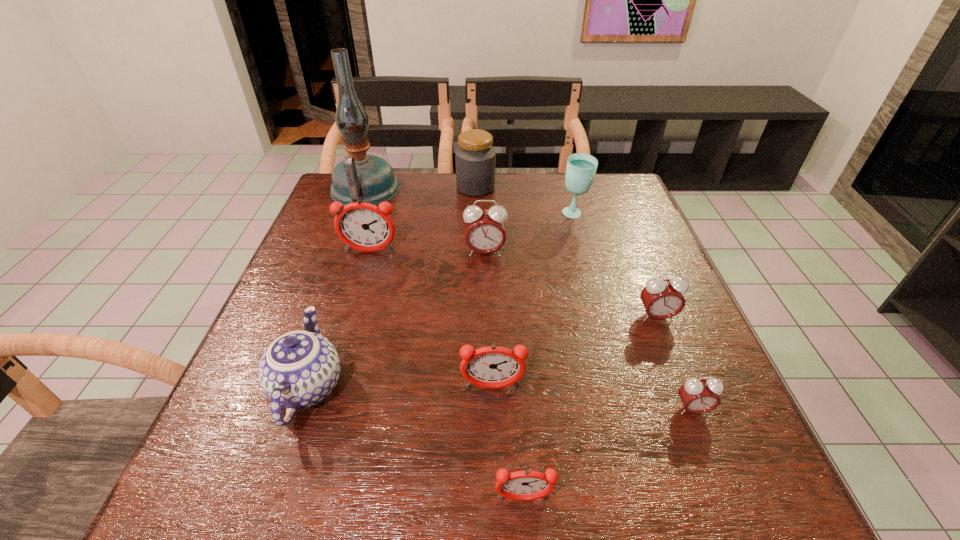
The width and height of the screenshot is (960, 540). I want to click on object located at the near edge, so click(x=526, y=485).

Where is `oil lamp that is positioned at the left edge`? This screenshot has width=960, height=540. oil lamp that is positioned at the left edge is located at coordinates (369, 178).

Where is `alarm clock present at the left edge`? The width and height of the screenshot is (960, 540). alarm clock present at the left edge is located at coordinates (363, 226).

The height and width of the screenshot is (540, 960). Identify the location of chinaware that is at the left edge. (299, 369).

You are a GUI agent. You are given a task and a screenshot of the screen. Output one action in this format:
    pyautogui.click(x=<x>, y=<y>)
    Task: Click on the glass at the right edge
    The image size is (960, 540).
    Given the screenshot: What is the action you would take?
    pyautogui.click(x=581, y=168)

Identify the location of object that is positioned at the far left corner. (369, 178).

What are the coordinates of `object situated at the far right corner` in the screenshot? It's located at (581, 168).

In the image, there is a desktop. Identify the location of vacant space at the far edge. The height and width of the screenshot is (540, 960). (460, 207).

The image size is (960, 540). Find the location of `free region at the near edge of the desktop`. free region at the near edge of the desktop is located at coordinates (451, 507).

This screenshot has width=960, height=540. In the image, there is a desktop. What are the coordinates of `free region at the left edge` in the screenshot? It's located at (288, 296).